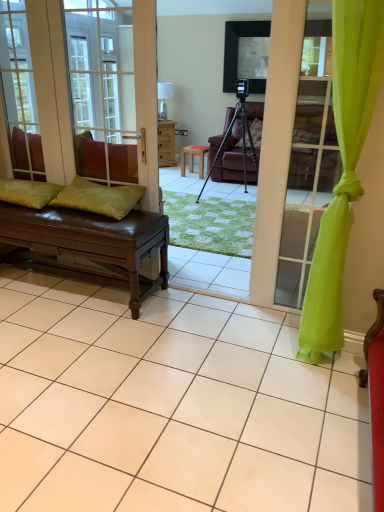
Question: From a real-world perspective, is matte black tripod at center on lime green fabric at right?

Choices:
 (A) no
 (B) yes

Answer: (A)

Question: Is matte black tripod at center not within lime green fabric at right?

Choices:
 (A) no
 (B) yes

Answer: (B)

Question: Does matte black tripod at center have a greater width compared to lime green fabric at right?

Choices:
 (A) no
 (B) yes

Answer: (B)

Question: Considering the relative positions of matte black tripod at center and lime green fabric at right in the image provided, is matte black tripod at center behind lime green fabric at right?

Choices:
 (A) no
 (B) yes

Answer: (B)

Question: Is lime green fabric at right a part of matte black tripod at center?

Choices:
 (A) no
 (B) yes

Answer: (A)

Question: Could you tell me if matte black tripod at center is turned towards lime green fabric at right?

Choices:
 (A) yes
 (B) no

Answer: (A)

Question: Is lime green fabric at right facing away from green fabric pillow at left, which is the 1th pillow in left-to-right order?

Choices:
 (A) no
 (B) yes

Answer: (A)

Question: From a real-world perspective, does lime green fabric at right sit lower than green fabric pillow at left, which is the 1th pillow in left-to-right order?

Choices:
 (A) no
 (B) yes

Answer: (A)

Question: Is lime green fabric at right smaller than green fabric pillow at left, the second pillow in the right-to-left sequence?

Choices:
 (A) no
 (B) yes

Answer: (A)

Question: Considering the relative positions of lime green fabric at right and green fabric pillow at left, which is the 1th pillow in left-to-right order, in the image provided, is lime green fabric at right behind green fabric pillow at left, which is the 1th pillow in left-to-right order,?

Choices:
 (A) no
 (B) yes

Answer: (A)

Question: Does lime green fabric at right have a lesser width compared to green fabric pillow at left, which is the 1th pillow in left-to-right order?

Choices:
 (A) no
 (B) yes

Answer: (B)

Question: Is green fabric pillow at left, which is the 1th pillow in left-to-right order, surrounded by lime green fabric at right?

Choices:
 (A) yes
 (B) no

Answer: (B)

Question: Is brown leather bench at left thinner than green leather pillow at left, placed as the 2th pillow when sorted from left to right?

Choices:
 (A) no
 (B) yes

Answer: (B)